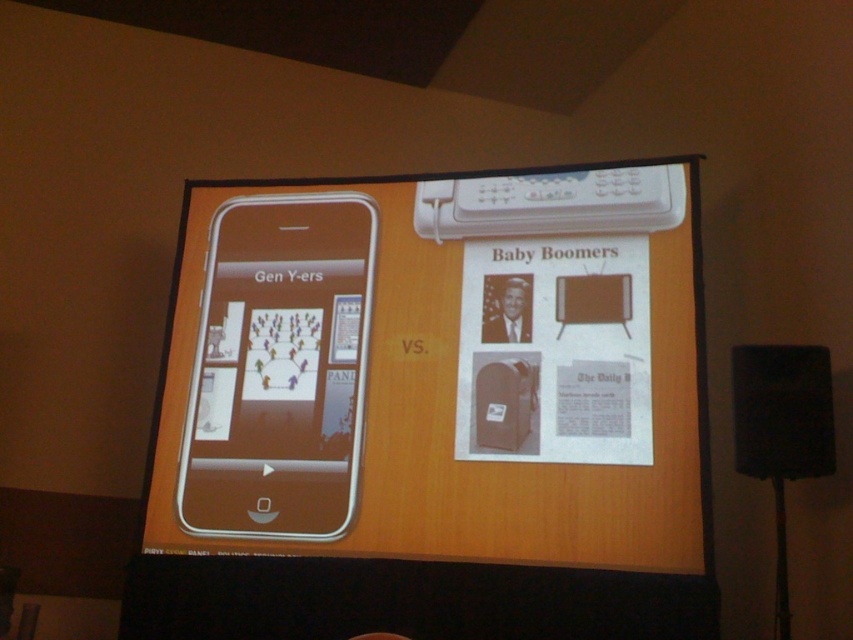
From the picture: Can you confirm if silver metallic phone at left is wider than silver metallic phone at center?

Indeed, silver metallic phone at left has a greater width compared to silver metallic phone at center.

Can you confirm if silver metallic phone at left is taller than silver metallic phone at center?

Yes.

Where is `silver metallic phone at left`? This screenshot has width=853, height=640. silver metallic phone at left is located at coordinates (436, 371).

Where is `silver metallic phone at left`? This screenshot has height=640, width=853. silver metallic phone at left is located at coordinates (436, 371).

Between silver metallic phone at center and black matte speaker at lower right, which one is positioned higher?

silver metallic phone at center is higher up.

The image size is (853, 640). What do you see at coordinates (279, 369) in the screenshot? I see `silver metallic phone at center` at bounding box center [279, 369].

Where is `silver metallic phone at center`? This screenshot has width=853, height=640. silver metallic phone at center is located at coordinates (279, 369).

Consider the image. Between silver metallic phone at left and black matte speaker at lower right, which one is positioned higher?

silver metallic phone at left

Is point (300, 353) positioned in front of point (746, 412)?

That is False.

The image size is (853, 640). I want to click on silver metallic phone at left, so click(x=436, y=371).

This screenshot has height=640, width=853. I want to click on silver metallic phone at left, so click(436, 371).